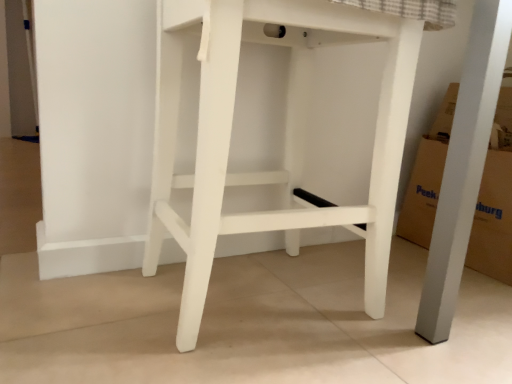
Image resolution: width=512 pixels, height=384 pixels. What are the coordinates of `vacant space underneath white matte stool at center (from a real-world perspective)` in the screenshot? It's located at coord(250,297).